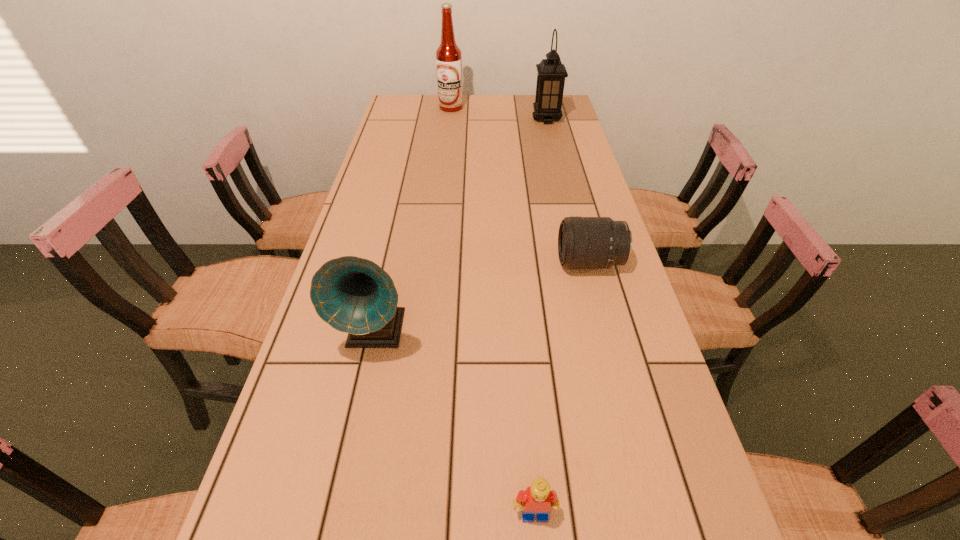
Identify the location of vacant region located from the horn of the phonograph_record. (344, 476).

I want to click on free region located on the surface of the telephoto lens, so click(x=421, y=262).

Find the location of a particular element. This screenshot has height=540, width=960. free region located on the surface of the telephoto lens is located at coordinates (433, 262).

Where is `free location located on the surface of the telephoto lens`? The height and width of the screenshot is (540, 960). free location located on the surface of the telephoto lens is located at coordinates (429, 262).

In order to click on alcohol present at the far edge in this screenshot , I will do `click(448, 55)`.

Where is `lantern at the far edge`? The height and width of the screenshot is (540, 960). lantern at the far edge is located at coordinates (551, 74).

Find the location of a particular element. The width and height of the screenshot is (960, 540). object that is at the left edge is located at coordinates (353, 295).

This screenshot has width=960, height=540. What are the coordinates of `lantern that is at the right edge` in the screenshot? It's located at [x=551, y=74].

At what (x,y) coordinates should I click in order to perform the action: click on telephoto lens that is at the right edge. Please return your answer as a coordinate pair (x, y). Looking at the image, I should click on (583, 242).

You are a GUI agent. You are given a task and a screenshot of the screen. Output one action in this format:
    pyautogui.click(x=<x>, y=<y>)
    Task: Click on the object that is at the far right corner
    
    Given the screenshot: What is the action you would take?
    pyautogui.click(x=551, y=74)